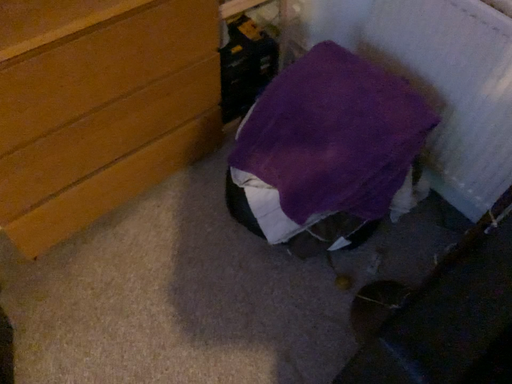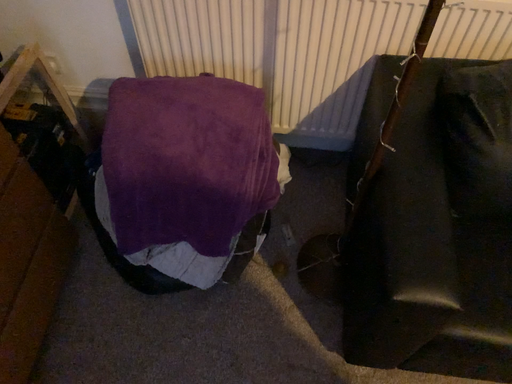
Question: Which way did the camera rotate in the video?

Choices:
 (A) rotated downward
 (B) rotated upward

Answer: (B)